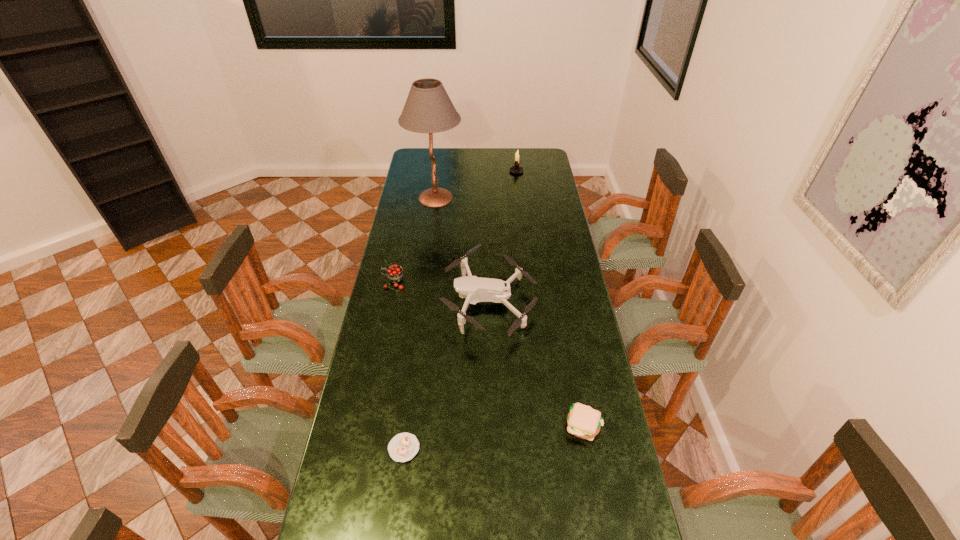
Where is `the second farthest object`? Image resolution: width=960 pixels, height=540 pixels. the second farthest object is located at coordinates (428, 109).

Locate an element on the screen. The height and width of the screenshot is (540, 960). the tallest object is located at coordinates (428, 109).

Identify the location of candle holder. The height and width of the screenshot is (540, 960). (516, 169).

Where is `drone`? Image resolution: width=960 pixels, height=540 pixels. drone is located at coordinates [475, 289].

The width and height of the screenshot is (960, 540). Find the location of `cherry`. cherry is located at coordinates (395, 274).

Locate an element on the screen. the rightmost object is located at coordinates (583, 421).

Find the location of a particular element. Image resolution: width=960 pixels, height=540 pixels. patty is located at coordinates 583,421.

Where is `the shortest object`? This screenshot has width=960, height=540. the shortest object is located at coordinates (403, 447).

The width and height of the screenshot is (960, 540). I want to click on free space located on the front-facing side of the tallest object, so click(523, 198).

You are a GUI agent. You are given a task and a screenshot of the screen. Output one action in this format:
    pyautogui.click(x=<x>, y=<y>)
    Task: Click on the vacant space located 0.080m on the front of the farthest object
    The width and height of the screenshot is (960, 540).
    Given the screenshot: What is the action you would take?
    pyautogui.click(x=517, y=183)